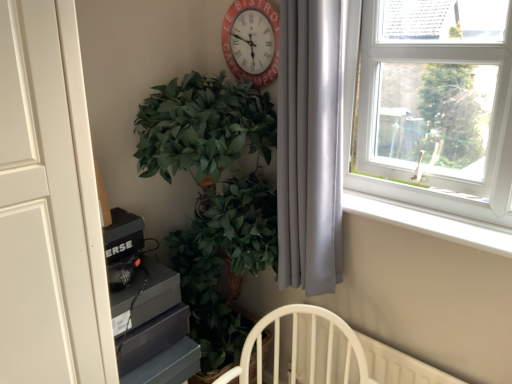
Question: Does red painted wood clock at upper center lie behind green leafy plant at center-left?

Choices:
 (A) no
 (B) yes

Answer: (B)

Question: From a real-world perspective, is red painted wood clock at upper center located beneath green leafy plant at center-left?

Choices:
 (A) no
 (B) yes

Answer: (A)

Question: Is red painted wood clock at upper center smaller than green leafy plant at center-left?

Choices:
 (A) no
 (B) yes

Answer: (B)

Question: Is there a large distance between red painted wood clock at upper center and green leafy plant at center-left?

Choices:
 (A) yes
 (B) no

Answer: (B)

Question: Can you confirm if red painted wood clock at upper center is shorter than green leafy plant at center-left?

Choices:
 (A) no
 (B) yes

Answer: (B)

Question: Relative to white plastic window sill at upper right, is silky gray curtain at right in front or behind?

Choices:
 (A) front
 (B) behind

Answer: (A)

Question: From the image's perspective, is silky gray curtain at right above or below white plastic window sill at upper right?

Choices:
 (A) below
 (B) above

Answer: (B)

Question: Considering the positions of point (321, 167) and point (346, 208), is point (321, 167) closer or farther from the camera than point (346, 208)?

Choices:
 (A) closer
 (B) farther

Answer: (A)

Question: Looking at the image, does silky gray curtain at right seem bigger or smaller compared to white plastic window sill at upper right?

Choices:
 (A) small
 (B) big

Answer: (B)

Question: Is green leafy plant at center-left bigger or smaller than white plastic window at upper right?

Choices:
 (A) small
 (B) big

Answer: (B)

Question: From a real-world perspective, relative to white plastic window at upper right, is green leafy plant at center-left vertically above or below?

Choices:
 (A) below
 (B) above

Answer: (A)

Question: Does point [x=208, y=190] appear closer or farther from the camera than point [x=452, y=29]?

Choices:
 (A) farther
 (B) closer

Answer: (A)

Question: Would you say green leafy plant at center-left is inside or outside white plastic window at upper right?

Choices:
 (A) inside
 (B) outside

Answer: (B)

Question: Visually, is red painted wood clock at upper center positioned to the left or to the right of white plastic window sill at upper right?

Choices:
 (A) right
 (B) left

Answer: (B)

Question: Is red painted wood clock at upper center wider or thinner than white plastic window sill at upper right?

Choices:
 (A) thin
 (B) wide

Answer: (A)